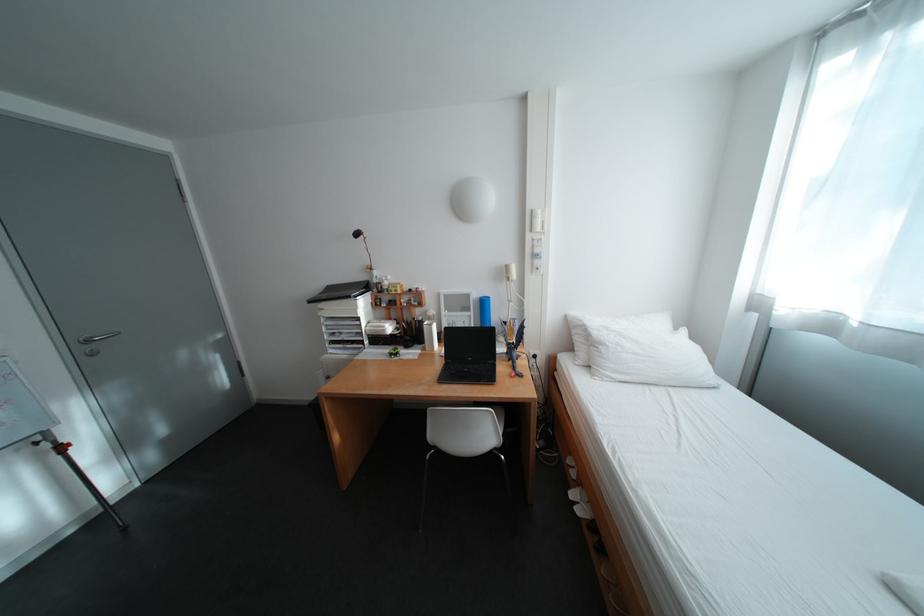
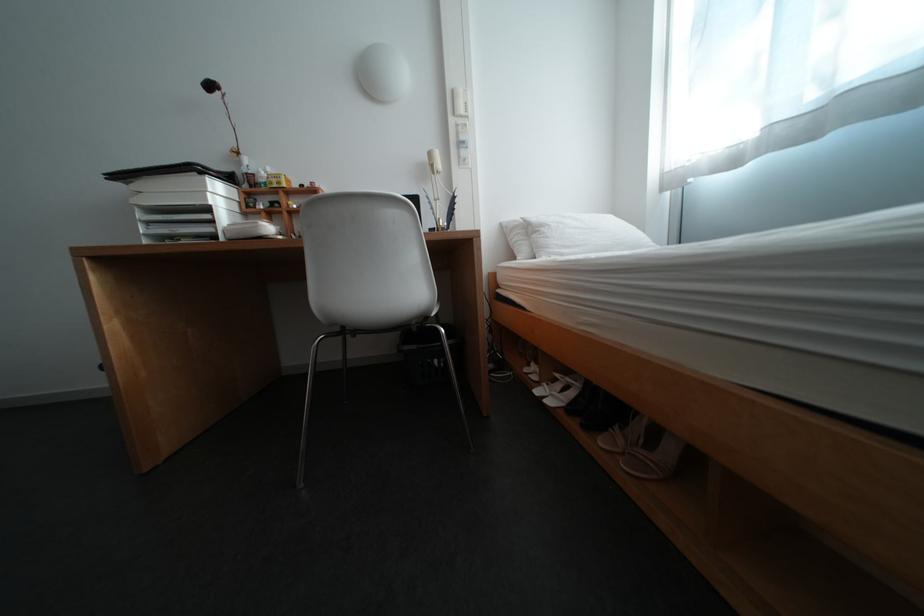
In the second image, find the point that corresponds to the point at 544,213 in the first image.

(466, 92)